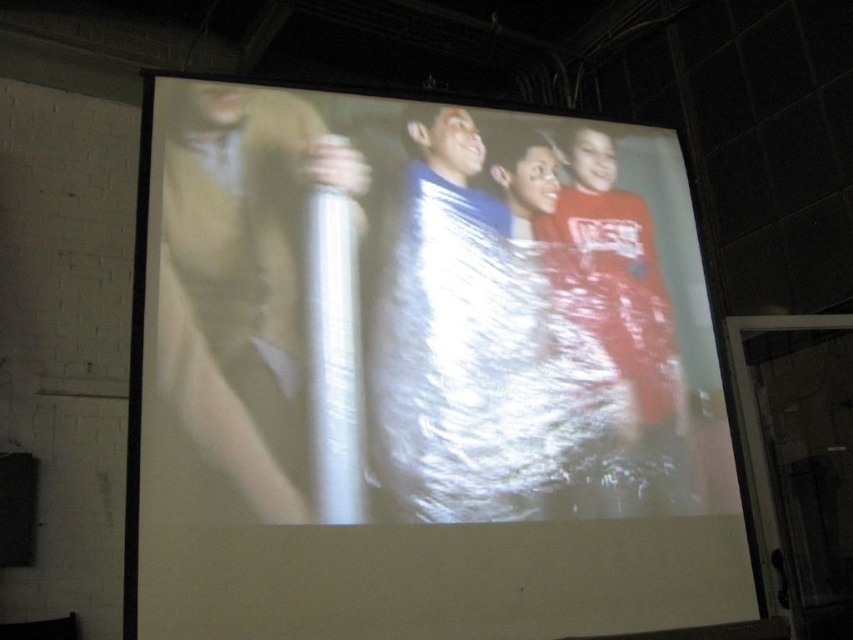
Question: Which point is farther from the camera taking this photo?

Choices:
 (A) (296, 513)
 (B) (691, 257)

Answer: (B)

Question: Does white glossy screen at center appear on the right side of metallic silver canister at left?

Choices:
 (A) yes
 (B) no

Answer: (A)

Question: Can you confirm if white glossy screen at center is positioned above metallic silver canister at left?

Choices:
 (A) yes
 (B) no

Answer: (B)

Question: Which point is farther to the camera?

Choices:
 (A) [286, 627]
 (B) [283, 136]

Answer: (B)

Question: Can you confirm if white glossy screen at center is positioned above metallic silver canister at left?

Choices:
 (A) no
 (B) yes

Answer: (A)

Question: Which object is farther from the camera taking this photo?

Choices:
 (A) metallic silver canister at left
 (B) white glossy screen at center

Answer: (A)